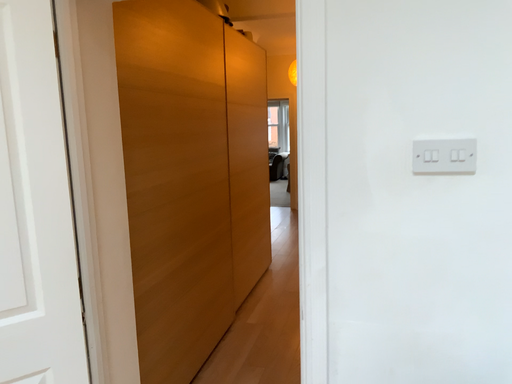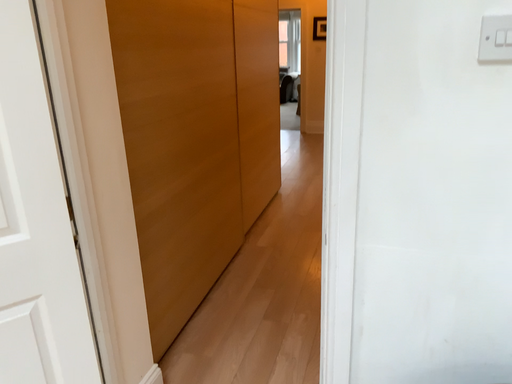
Question: How did the camera likely rotate when shooting the video?

Choices:
 (A) rotated downward
 (B) rotated upward

Answer: (A)